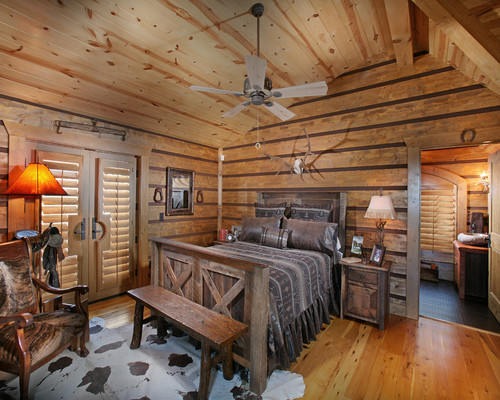
Where is `ceiling`? ceiling is located at coordinates (339, 26).